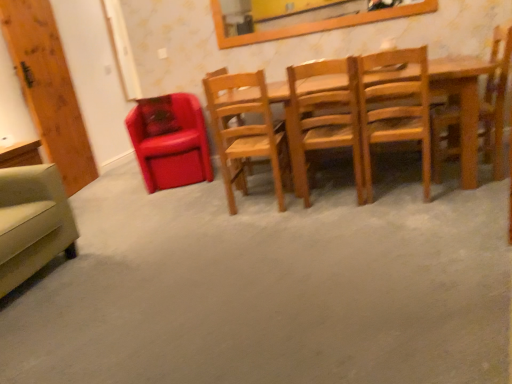
The width and height of the screenshot is (512, 384). Identify the location of vacant area to the right of wooden chair at center, marked as the 2th chair in a right-to-left arrangement. (464, 187).